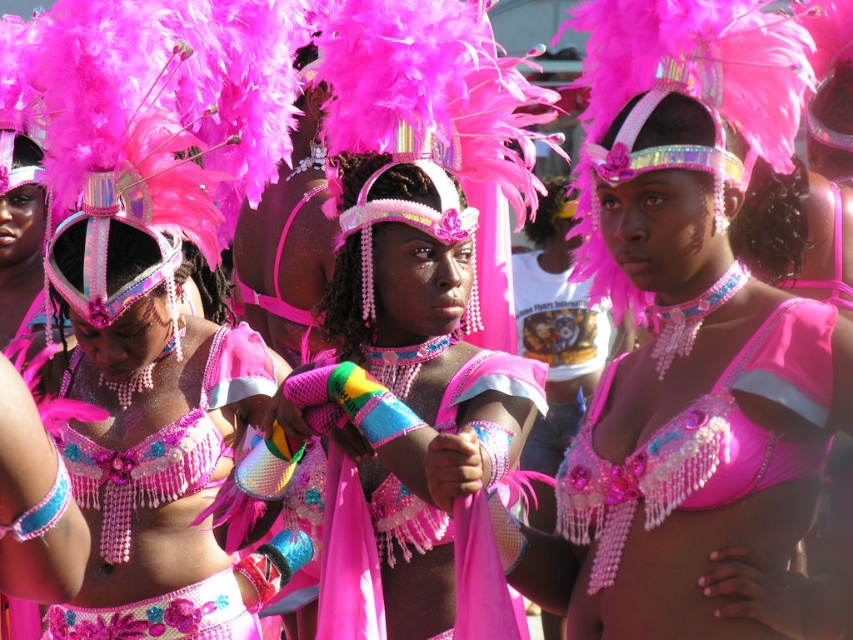
You are a photographer trying to capture the performers in the center. You notice two bikini tops at the center. Which one is closer to you, the shiny pink bikini top at center or the pink beaded bikini top at center?

The shiny pink bikini top at center is closer to you because it is in front of the pink beaded bikini top at center.

You are a photographer standing at a certain distance from the two bikinis in the image. The matte pink bikini at center and the pink beaded bikini top at center are both in your view. If your camera has a maximum zoom range of 10 meters, can you capture clear details of both bikinis without moving closer?

The matte pink bikini at center is 11.85 meters away from the pink beaded bikini top at center. Since the distance between them is greater than the camera maximum zoom range of 10 meters, you cannot capture clear details of both bikinis without moving closer.